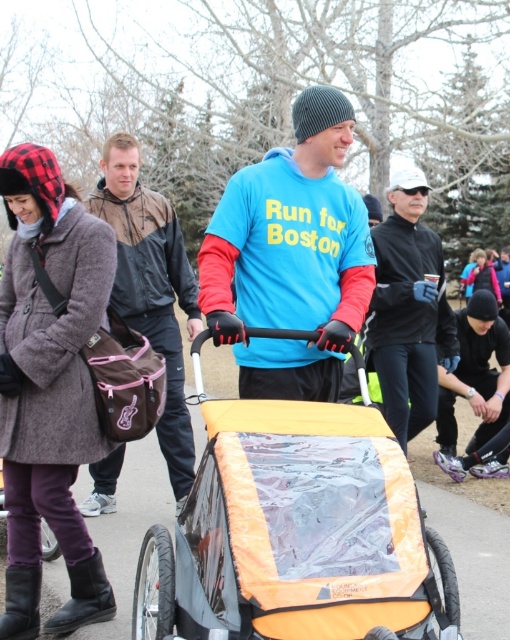
Question: Where is orange fabric baby carriage at center located in relation to blue fleece jacket at center in the image?

Choices:
 (A) below
 (B) above

Answer: (A)

Question: Which point appears farthest from the camera in this image?

Choices:
 (A) (174, 444)
 (B) (399, 205)
 (C) (295, 252)

Answer: (B)

Question: Which point appears closest to the camera in this image?

Choices:
 (A) (139, 324)
 (B) (397, 172)
 (C) (205, 611)
 (D) (363, 266)

Answer: (C)

Question: Can you confirm if blue matte t-shirt at center is smaller than blue fleece jacket at center?

Choices:
 (A) no
 (B) yes

Answer: (B)

Question: Is blue matte t-shirt at center below brown fabric jacket at center?

Choices:
 (A) yes
 (B) no

Answer: (B)

Question: Which of the following is the closest to the observer?

Choices:
 (A) (382, 317)
 (B) (282, 417)
 (C) (192, 449)

Answer: (B)